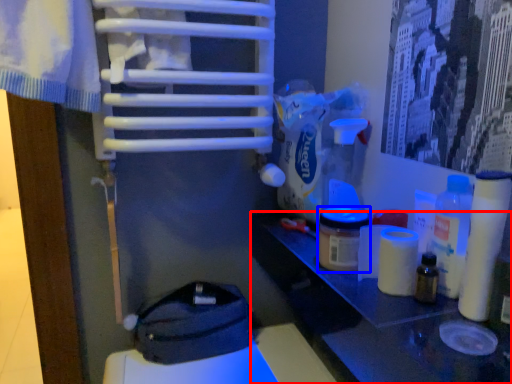
Question: Which object is further to the camera taking this photo, table (highlighted by a red box) or product (highlighted by a blue box)?

Choices:
 (A) table
 (B) product

Answer: (B)